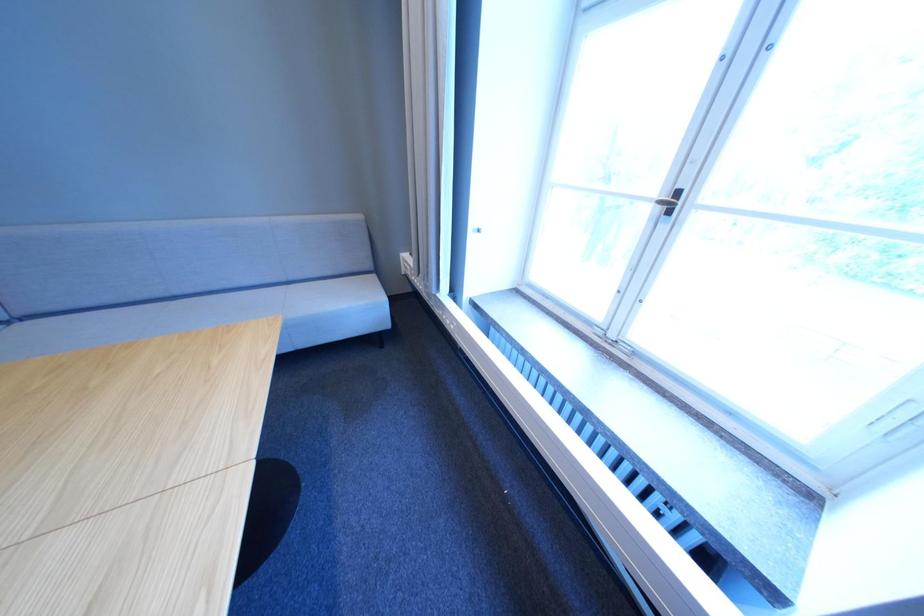
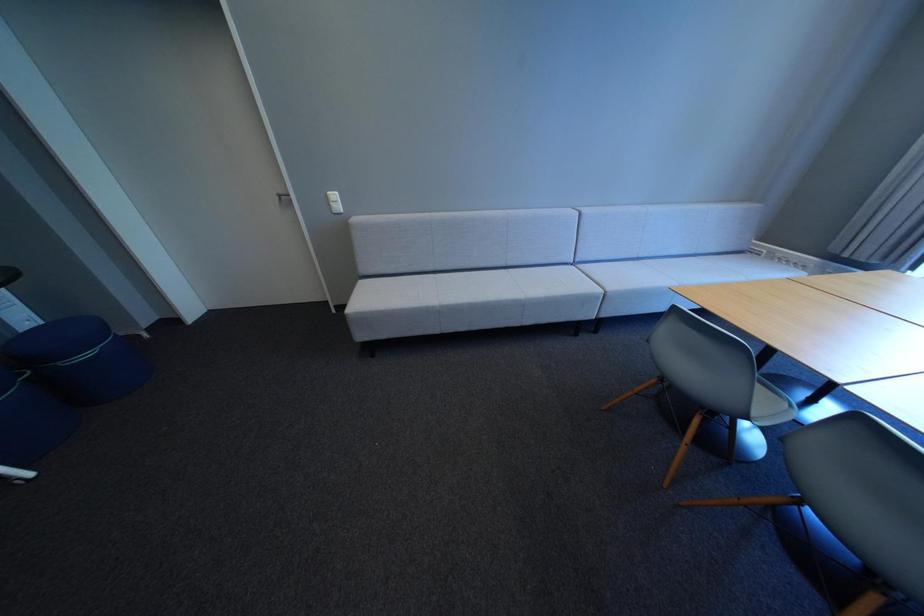
In a continuous first-person perspective shot, in which direction is the camera moving?

The cameraman walked toward left, backward.